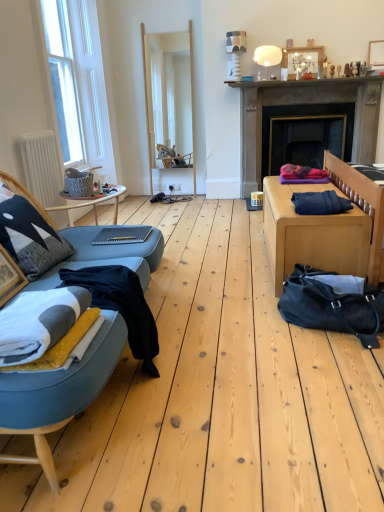
This screenshot has height=512, width=384. What do you see at coordinates (312, 234) in the screenshot? I see `wooden table at right, the 2th table in the left-to-right sequence` at bounding box center [312, 234].

Measure the distance between dark blue fabric at right, which appears as the 1th clothing when viewed from the right, and camera.

The depth of dark blue fabric at right, which appears as the 1th clothing when viewed from the right, is 2.28 meters.

The height and width of the screenshot is (512, 384). What do you see at coordinates (78, 83) in the screenshot?
I see `white wooden window at left` at bounding box center [78, 83].

Locate an element on the screen. The image size is (384, 512). white wooden window at left is located at coordinates (78, 83).

Based on the photo, in order to face wooden picture frame at upper right, which is the 2th picture frame from front to back, should I rotate leftwards or rightwards?

It's best to rotate right around 24.499 degrees.

This screenshot has width=384, height=512. Identify the location of wooden picture frame at left, the second picture frame from the right. (9, 277).

Is point (241, 122) more distant than point (19, 277)?

Yes, point (241, 122) is farther from viewer.

From a real-world perspective, does dark gray stone fireplace at center right sit lower than wooden picture frame at left, the second picture frame in the top-to-bottom sequence?

Actually, dark gray stone fireplace at center right is physically above wooden picture frame at left, the second picture frame in the top-to-bottom sequence, in the real world.

Does dark gray stone fireplace at center right have a greater height compared to wooden picture frame at left, the second picture frame in the top-to-bottom sequence?

Yes, dark gray stone fireplace at center right is taller than wooden picture frame at left, the second picture frame in the top-to-bottom sequence.

Are dark gray stone fireplace at center right and wooden picture frame at left, the 1th picture frame viewed from the left, making contact?

No, dark gray stone fireplace at center right is not beside wooden picture frame at left, the 1th picture frame viewed from the left.

Is white wooden window at left next to wooden frame mirror at center?

There is a gap between white wooden window at left and wooden frame mirror at center.

Is white wooden window at left in front of or behind wooden frame mirror at center in the image?

white wooden window at left is in front of wooden frame mirror at center.

Which of these two, white wooden window at left or wooden frame mirror at center, is smaller?

wooden frame mirror at center is smaller.

The width and height of the screenshot is (384, 512). What are the coordinates of `mirror to the right of white wooden window at left` in the screenshot? It's located at (169, 106).

In terms of width, does wooden picture frame at upper right, which appears as the first picture frame when viewed from the right, look wider or thinner when compared to dark gray stone fireplace at center right?

In the image, wooden picture frame at upper right, which appears as the first picture frame when viewed from the right, appears to be more narrow than dark gray stone fireplace at center right.

From a real-world perspective, is wooden picture frame at upper right, which is the second picture frame in bottom-to-top order, physically above dark gray stone fireplace at center right?

Yes, from a real-world perspective, wooden picture frame at upper right, which is the second picture frame in bottom-to-top order, is over dark gray stone fireplace at center right

From the image's perspective, is wooden picture frame at upper right, which is the second picture frame in bottom-to-top order, located above dark gray stone fireplace at center right?

Yes, from the image's perspective, wooden picture frame at upper right, which is the second picture frame in bottom-to-top order, is over dark gray stone fireplace at center right.

In the scene shown: Does wooden picture frame at upper right, which is counted as the 1th picture frame, starting from the top, come in front of dark gray stone fireplace at center right?

Yes, the depth of wooden picture frame at upper right, which is counted as the 1th picture frame, starting from the top, is less than that of dark gray stone fireplace at center right.

Is wooden table at right, which appears as the 1th table when viewed from the right, positioned with its back to white wooden window at left?

No, wooden table at right, which appears as the 1th table when viewed from the right,'s orientation is not away from white wooden window at left.

Can you tell me how much wooden table at right, the 2th table in the left-to-right sequence, and white wooden window at left differ in facing direction?

179 degrees separate the facing orientations of wooden table at right, the 2th table in the left-to-right sequence, and white wooden window at left.

Between wooden table at right, the 2th table in the left-to-right sequence, and white wooden window at left, which one has smaller width?

Thinner between the two is white wooden window at left.

Is wooden table at right, which appears as the 1th table when viewed from the right, positioned in front of white wooden window at left?

Yes, it is.

Between black leather duffel bag at lower right and wooden frame mirror at center, which one is positioned behind?

wooden frame mirror at center.

Is there a large distance between black leather duffel bag at lower right and wooden frame mirror at center?

That's right, there is a large distance between black leather duffel bag at lower right and wooden frame mirror at center.

Would you say black leather duffel bag at lower right is inside or outside wooden frame mirror at center?

black leather duffel bag at lower right lies outside wooden frame mirror at center.

Considering the points (342, 311) and (170, 44), which point is in front, point (342, 311) or point (170, 44)?

The point (342, 311) is closer to the camera.

Can you confirm if black leather duffel bag at lower right is shorter than dark gray stone fireplace at center right?

Yes.

Is black leather duffel bag at lower right turned away from dark gray stone fireplace at center right?

No, black leather duffel bag at lower right is not facing the opposite direction of dark gray stone fireplace at center right.

Between black leather duffel bag at lower right and dark gray stone fireplace at center right, which one appears on the right side from the viewer's perspective?

Result: dark gray stone fireplace at center right is more to the right.

Is black leather duffel bag at lower right far away from dark gray stone fireplace at center right?

That's right, there is a large distance between black leather duffel bag at lower right and dark gray stone fireplace at center right.

Is point (357, 320) closer or farther from the camera than point (56, 97)?

Clearly, point (357, 320) is closer to the camera than point (56, 97).

Does black leather duffel bag at lower right have a lesser width compared to white wooden window at left?

In fact, black leather duffel bag at lower right might be wider than white wooden window at left.

Can you confirm if black leather duffel bag at lower right is shorter than white wooden window at left?

Yes.

This screenshot has height=512, width=384. In the image, there is a dark gray stone fireplace at center right. What are the coordinates of `picture frame below it (from a real-world perspective)` in the screenshot? It's located at [9, 277].

At what (x,y) coordinates should I click in order to perform the action: click on window that appears above the wooden frame mirror at center (from a real-world perspective). Please return your answer as a coordinate pair (x, y). Looking at the image, I should click on (x=78, y=83).

When comparing their distances from matte gray table at center, acting as the 2th table starting from the right, does dark blue fabric at right, the first clothing positioned from the top, or knitted fabric pillow at left seem closer?

Based on the image, knitted fabric pillow at left appears to be nearer to matte gray table at center, acting as the 2th table starting from the right.

When comparing their distances from knitted fabric pillow at left, does matte gray table at center, acting as the 2th table starting from the right, or white cotton blanket at lower left, marked as the second clothing in a back-to-front arrangement, seem further?

The object further to knitted fabric pillow at left is matte gray table at center, acting as the 2th table starting from the right.

Looking at the image, which one is located further to white cotton blanket at lower left, the first clothing positioned from the bottom, white fleece blanket at left or wooden table at right, which appears as the 1th table when viewed from the right?

wooden table at right, which appears as the 1th table when viewed from the right, is further to white cotton blanket at lower left, the first clothing positioned from the bottom.

Estimate the real-world distances between objects in this image. Which object is closer to knitted fabric pillow at left, wooden table at right, the 2th table in the left-to-right sequence, or dark gray stone fireplace at center right?

wooden table at right, the 2th table in the left-to-right sequence, lies closer to knitted fabric pillow at left than the other object.

From the picture: Estimate the real-world distances between objects in this image. Which object is closer to white matte radiator at left, smooth concrete mantle at upper center or wooden frame mirror at center?

Based on the image, wooden frame mirror at center appears to be nearer to white matte radiator at left.

Looking at the image, which one is located further to dark gray stone fireplace at center right, wooden picture frame at upper right, which is the first picture frame in back-to-front order, or white wooden window at left?

white wooden window at left.

Based on their spatial positions, is knitted fabric pillow at left or dark blue fabric at right, which is the 2th clothing in front-to-back order, further from wooden picture frame at upper right, which is the second picture frame in bottom-to-top order?

knitted fabric pillow at left lies further to wooden picture frame at upper right, which is the second picture frame in bottom-to-top order, than the other object.

Estimate the real-world distances between objects in this image. Which object is further from white cotton blanket at lower left, the first clothing positioned from the bottom, dark gray stone fireplace at center right or wooden picture frame at left, which is counted as the first picture frame, starting from the bottom?

dark gray stone fireplace at center right is further to white cotton blanket at lower left, the first clothing positioned from the bottom.

Find the location of a particular element. The height and width of the screenshot is (512, 384). picture frame between knitted fabric pillow at left and white cotton blanket at lower left, marked as the second clothing in a back-to-front arrangement, from left to right is located at coordinates (9, 277).

This screenshot has height=512, width=384. Identify the location of window located between wooden picture frame at left, arranged as the first picture frame when viewed from the front, and dark gray stone fireplace at center right in the depth direction. (78, 83).

This screenshot has width=384, height=512. I want to click on table between white matte radiator at left and dark blue fabric at right, the first clothing positioned from the top, in the horizontal direction, so click(x=90, y=203).

You are a GUI agent. You are given a task and a screenshot of the screen. Output one action in this format:
    pyautogui.click(x=<x>, y=<y>)
    Task: Click on the picture frame between wooden picture frame at left, the second picture frame in the top-to-bottom sequence, and dark gray stone fireplace at center right from front to back
    
    Given the screenshot: What is the action you would take?
    pyautogui.click(x=376, y=53)